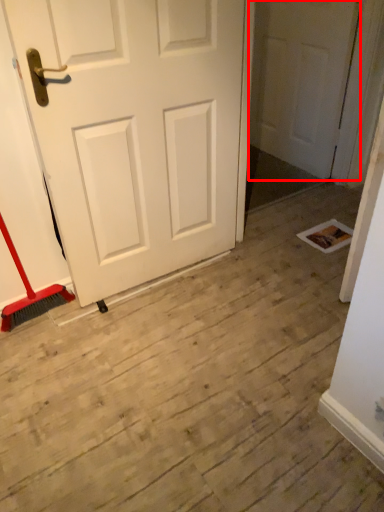
Question: From the image's perspective, where is door (annotated by the red box) located relative to door?

Choices:
 (A) above
 (B) below

Answer: (A)